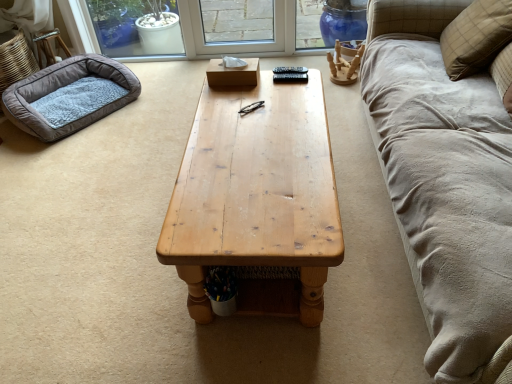
Describe the element at coordinates (233, 73) in the screenshot. The image size is (512, 384). I see `wooden tissue box at center` at that location.

Describe the element at coordinates (63, 96) in the screenshot. I see `soft gray fleece dog bed at left` at that location.

Where is `beige plaid pillow at upper right`? The image size is (512, 384). beige plaid pillow at upper right is located at coordinates (476, 37).

From a real-world perspective, between beige plaid pillow at upper right and wooden tissue box at center, who is vertically lower?

wooden tissue box at center, from a real-world perspective.

Is beige plaid pillow at upper right far away from wooden tissue box at center?

Yes.

Which of these two, beige plaid pillow at upper right or wooden tissue box at center, is smaller?

Smaller between the two is wooden tissue box at center.

Can you tell me how much beige plaid pillow at upper right and wooden tissue box at center differ in facing direction?

The angular difference between beige plaid pillow at upper right and wooden tissue box at center is 11.4 degrees.

Is soft gray fleece dog bed at left at the back of wooden tissue box at center?

No.

Based on their sizes in the image, would you say wooden tissue box at center is bigger or smaller than soft gray fleece dog bed at left?

Clearly, wooden tissue box at center is smaller in size than soft gray fleece dog bed at left.

From a real-world perspective, does wooden tissue box at center sit lower than soft gray fleece dog bed at left?

No.

From a real-world perspective, is natural wood coffee table at center positioned under soft gray fleece dog bed at left based on gravity?

Incorrect, from a real-world perspective, natural wood coffee table at center is higher than soft gray fleece dog bed at left.

Who is bigger, natural wood coffee table at center or soft gray fleece dog bed at left?

natural wood coffee table at center is bigger.

Between point (201, 293) and point (94, 112), which one is positioned in front?

Point (201, 293)

I want to click on dog bed located behind the natural wood coffee table at center, so click(63, 96).

Is soft gray fleece dog bed at left looking in the opposite direction of natural wood coffee table at center?

No, soft gray fleece dog bed at left's orientation is not away from natural wood coffee table at center.

Considering the points (47, 85) and (307, 156), which point is in front, point (47, 85) or point (307, 156)?

The point (307, 156) is in front.

Considering the relative sizes of soft gray fleece dog bed at left and natural wood coffee table at center in the image provided, is soft gray fleece dog bed at left shorter than natural wood coffee table at center?

Indeed, soft gray fleece dog bed at left has a lesser height compared to natural wood coffee table at center.

This screenshot has width=512, height=384. I want to click on dog bed that appears above the natural wood coffee table at center (from the image's perspective), so click(63, 96).

Which of these two, soft gray fleece dog bed at left or beige plaid pillow at upper right, stands taller?

beige plaid pillow at upper right.

Does soft gray fleece dog bed at left have a greater width compared to beige plaid pillow at upper right?

Correct, the width of soft gray fleece dog bed at left exceeds that of beige plaid pillow at upper right.

Is soft gray fleece dog bed at left situated inside beige plaid pillow at upper right or outside?

soft gray fleece dog bed at left cannot be found inside beige plaid pillow at upper right.

Find the location of a particular element. The height and width of the screenshot is (384, 512). dog bed below the beige plaid pillow at upper right (from a real-world perspective) is located at coordinates click(x=63, y=96).

Is soft gray fleece dog bed at left positioned far away from wooden tissue box at center?

Yes, soft gray fleece dog bed at left and wooden tissue box at center are quite far apart.

Is soft gray fleece dog bed at left inside the boundaries of wooden tissue box at center, or outside?

The correct answer is: outside.

Locate an element on the screen. This screenshot has width=512, height=384. dog bed on the left of wooden tissue box at center is located at coordinates (63, 96).

Is point (75, 98) in front of point (224, 72)?

That is False.

Is beige plaid pillow at upper right facing towards natural wood coffee table at center?

No, beige plaid pillow at upper right is not facing towards natural wood coffee table at center.

Considering the sizes of objects beige plaid pillow at upper right and natural wood coffee table at center in the image provided, who is wider, beige plaid pillow at upper right or natural wood coffee table at center?

Wider between the two is natural wood coffee table at center.

In the scene shown: Does beige plaid pillow at upper right appear on the right side of natural wood coffee table at center?

Correct, you'll find beige plaid pillow at upper right to the right of natural wood coffee table at center.

Which object is more forward, beige plaid pillow at upper right or natural wood coffee table at center?

natural wood coffee table at center is more forward.

Locate an element on the screen. pillow above the wooden tissue box at center (from the image's perspective) is located at coordinates (476, 37).

You are a GUI agent. You are given a task and a screenshot of the screen. Output one action in this format:
    pyautogui.click(x=<x>, y=<y>)
    Task: Click on the box on the right of soft gray fleece dog bed at left
    
    Given the screenshot: What is the action you would take?
    pyautogui.click(x=233, y=73)

From the image, which object appears to be nearer to natural wood coffee table at center, beige plaid pillow at upper right or soft gray fleece dog bed at left?

beige plaid pillow at upper right is closer to natural wood coffee table at center.

Which object lies further to the anchor point wooden tissue box at center, soft gray fleece dog bed at left or natural wood coffee table at center?

soft gray fleece dog bed at left lies further to wooden tissue box at center than the other object.

Which object lies nearer to the anchor point beige plaid pillow at upper right, soft gray fleece dog bed at left or natural wood coffee table at center?

natural wood coffee table at center is positioned closer to the anchor beige plaid pillow at upper right.

Looking at the image, which one is located closer to wooden tissue box at center, soft gray fleece dog bed at left or beige plaid pillow at upper right?

Among the two, beige plaid pillow at upper right is located nearer to wooden tissue box at center.

From the image, which object appears to be nearer to wooden tissue box at center, natural wood coffee table at center or beige plaid pillow at upper right?

Among the two, natural wood coffee table at center is located nearer to wooden tissue box at center.

Which object lies nearer to the anchor point soft gray fleece dog bed at left, beige plaid pillow at upper right or wooden tissue box at center?

wooden tissue box at center is closer to soft gray fleece dog bed at left.

Based on their spatial positions, is wooden tissue box at center or natural wood coffee table at center further from soft gray fleece dog bed at left?

The object further to soft gray fleece dog bed at left is natural wood coffee table at center.

Estimate the real-world distances between objects in this image. Which object is further from beige plaid pillow at upper right, soft gray fleece dog bed at left or wooden tissue box at center?

soft gray fleece dog bed at left lies further to beige plaid pillow at upper right than the other object.

Where is `coffee table located between wooden tissue box at center and beige plaid pillow at upper right in the left-right direction`? This screenshot has width=512, height=384. coffee table located between wooden tissue box at center and beige plaid pillow at upper right in the left-right direction is located at coordinates (257, 199).

Identify the location of coffee table between soft gray fleece dog bed at left and beige plaid pillow at upper right. The image size is (512, 384). (257, 199).

Image resolution: width=512 pixels, height=384 pixels. In order to click on box between soft gray fleece dog bed at left and natural wood coffee table at center from left to right in this screenshot , I will do `click(233, 73)`.

The height and width of the screenshot is (384, 512). Find the location of `box situated between soft gray fleece dog bed at left and beige plaid pillow at upper right from left to right`. box situated between soft gray fleece dog bed at left and beige plaid pillow at upper right from left to right is located at coordinates (233, 73).